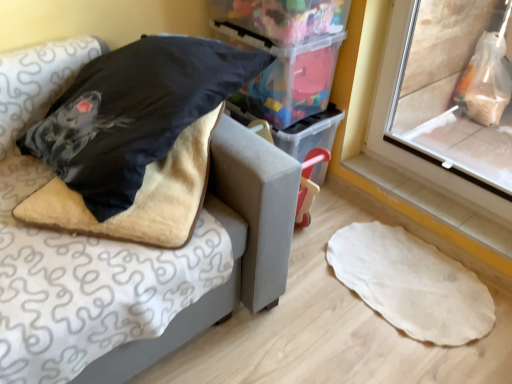
Question: In the image, is velvet-like beige cushion at upper left positioned in front of or behind white tile at lower right?

Choices:
 (A) behind
 (B) front

Answer: (B)

Question: From a real-world perspective, is velvet-like beige cushion at upper left physically located above or below white tile at lower right?

Choices:
 (A) below
 (B) above

Answer: (B)

Question: Which object is the closest to the velvet black pillow at upper left?

Choices:
 (A) white tile at lower right
 (B) velvet-like beige cushion at upper left
 (C) fuzzy beige blanket at left
 (D) translucent plastic storage box at upper center
 (E) transparent plastic window screen at right

Answer: (C)

Question: Estimate the real-world distances between objects in this image. Which object is closer to the velvet-like beige cushion at upper left?

Choices:
 (A) white tile at lower right
 (B) fuzzy beige blanket at left
 (C) translucent plastic storage box at upper center
 (D) white felt rug at lower right
 (E) transparent plastic window screen at right

Answer: (B)